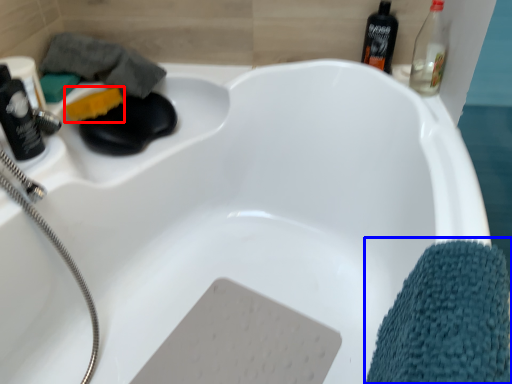
Question: Which object appears closest to the camera in this image, soap (highlighted by a red box) or bath towel (highlighted by a blue box)?

Choices:
 (A) soap
 (B) bath towel

Answer: (B)